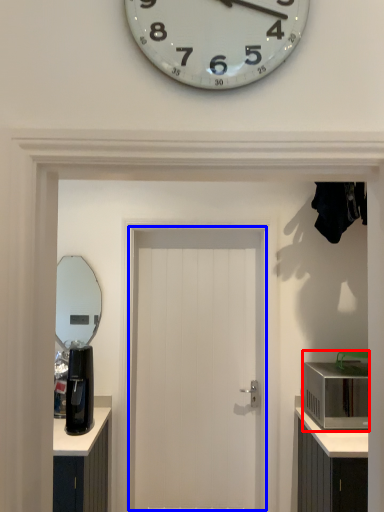
Question: Which of the following is the closest to the observer, appliance (highlighted by a red box) or door (highlighted by a blue box)?

Choices:
 (A) appliance
 (B) door

Answer: (A)